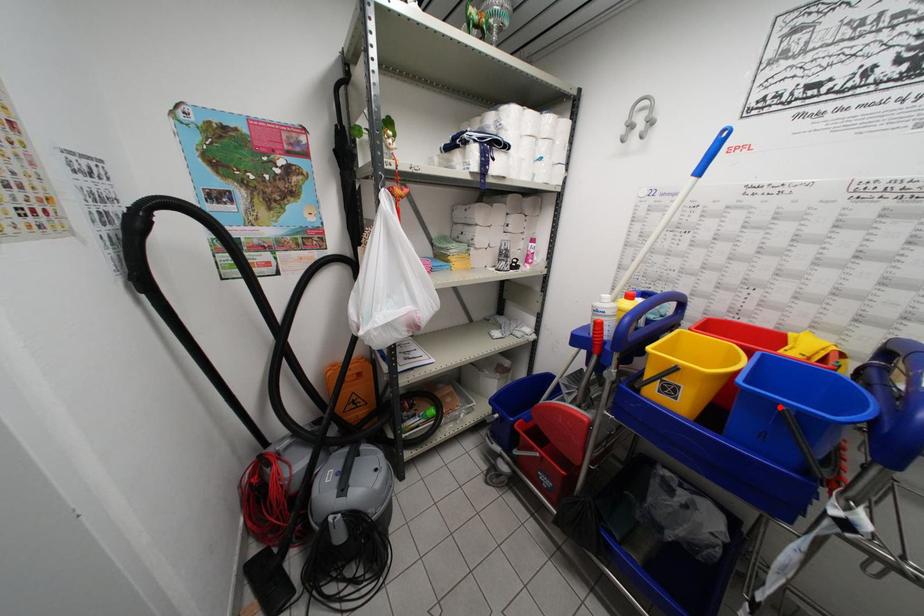
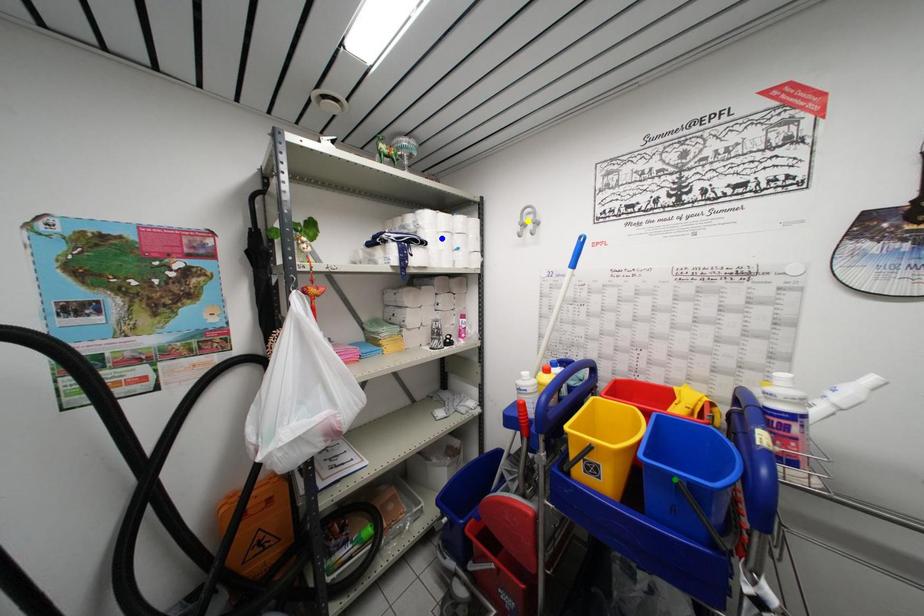
Question: I am providing you with two images of the same scene from different viewpoints. A red point is marked on the first image. You are given multiple points on the second image. Can you choose the point in image 2 that corresponds to the point in image 1?

Choices:
 (A) yellow point
 (B) green point
 (C) blue point

Answer: (B)